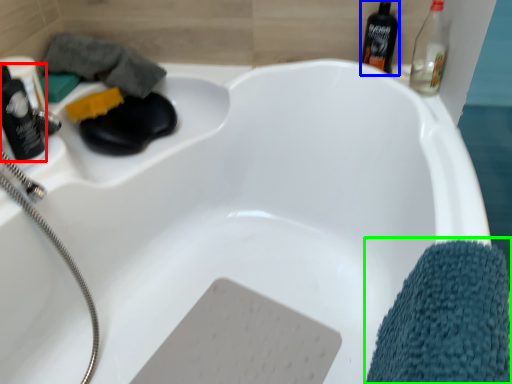
Question: Based on their relative distances, which object is nearer to bottle (highlighted by a red box)? Choose from mouthwash (highlighted by a blue box) and bath towel (highlighted by a green box).

Choices:
 (A) mouthwash
 (B) bath towel

Answer: (B)